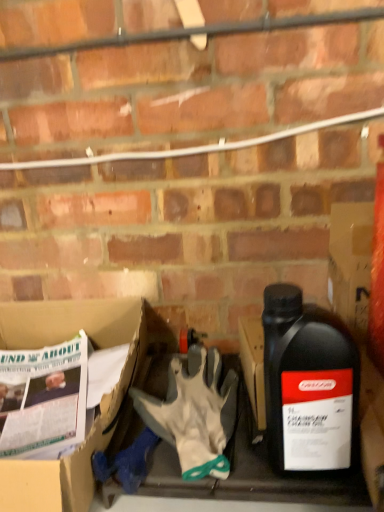
Question: Is the surface of black plastic bottle at right in direct contact with white cardboard box at lower left?

Choices:
 (A) no
 (B) yes

Answer: (A)

Question: From the image's perspective, is black plastic bottle at right below white cardboard box at lower left?

Choices:
 (A) yes
 (B) no

Answer: (B)

Question: Is white cardboard box at lower left surrounded by black plastic bottle at right?

Choices:
 (A) yes
 (B) no

Answer: (B)

Question: Does black plastic bottle at right have a lesser width compared to white cardboard box at lower left?

Choices:
 (A) no
 (B) yes

Answer: (B)

Question: Considering the relative positions of black plastic bottle at right and white cardboard box at lower left in the image provided, is black plastic bottle at right to the left of white cardboard box at lower left from the viewer's perspective?

Choices:
 (A) no
 (B) yes

Answer: (A)

Question: From the image's perspective, is black plastic bottle at right on white cardboard box at lower left?

Choices:
 (A) no
 (B) yes

Answer: (B)

Question: Is white cardboard box at lower left taller than white fabric glove at center?

Choices:
 (A) no
 (B) yes

Answer: (B)

Question: Can you confirm if white cardboard box at lower left is wider than white fabric glove at center?

Choices:
 (A) no
 (B) yes

Answer: (B)

Question: Is white cardboard box at lower left in contact with white fabric glove at center?

Choices:
 (A) no
 (B) yes

Answer: (A)

Question: Considering the relative positions of white cardboard box at lower left and white fabric glove at center in the image provided, is white cardboard box at lower left to the right of white fabric glove at center from the viewer's perspective?

Choices:
 (A) yes
 (B) no

Answer: (B)

Question: Can you confirm if white cardboard box at lower left is bigger than white fabric glove at center?

Choices:
 (A) yes
 (B) no

Answer: (A)

Question: Is white cardboard box at lower left positioned behind white fabric glove at center?

Choices:
 (A) no
 (B) yes

Answer: (A)

Question: Does white fabric glove at center have a larger size compared to black plastic bottle at right?

Choices:
 (A) yes
 (B) no

Answer: (B)